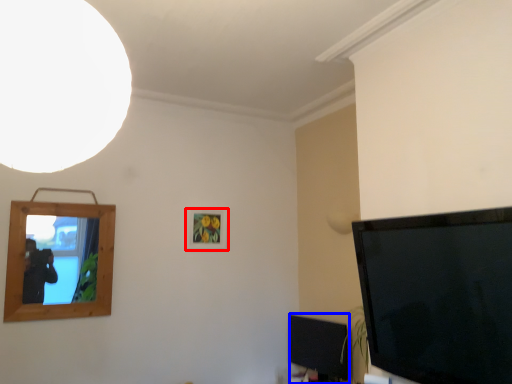
Question: Which object is further to the camera taking this photo, picture frame (highlighted by a red box) or television (highlighted by a blue box)?

Choices:
 (A) picture frame
 (B) television

Answer: (A)